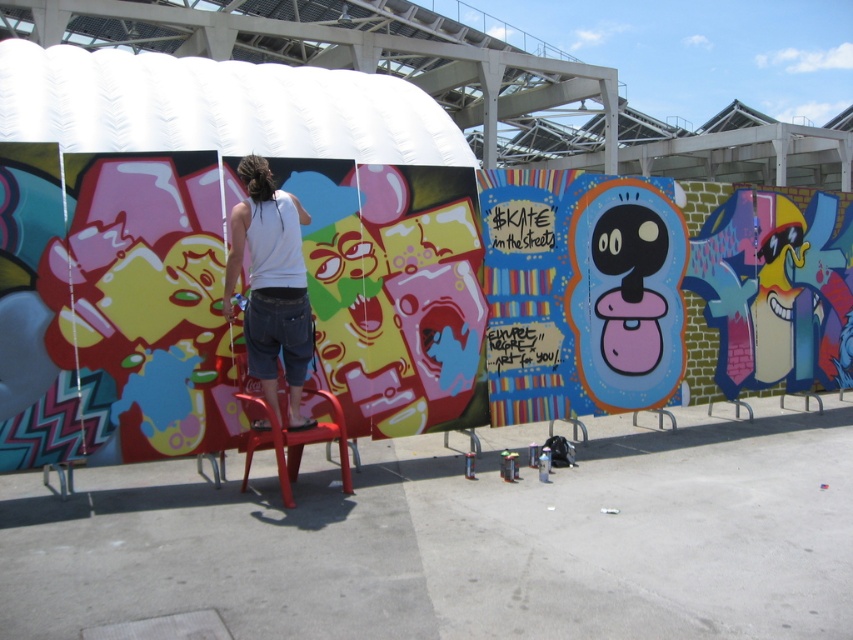
Based on the photo, you are an observer looking at the painting scene. You notice the white cotton tank top at center and the plastic red chair at center. Which object is positioned more to the left side of the scene?

The white cotton tank top at center is positioned to the left of the plastic red chair at center, so it is more to the left side of the scene.